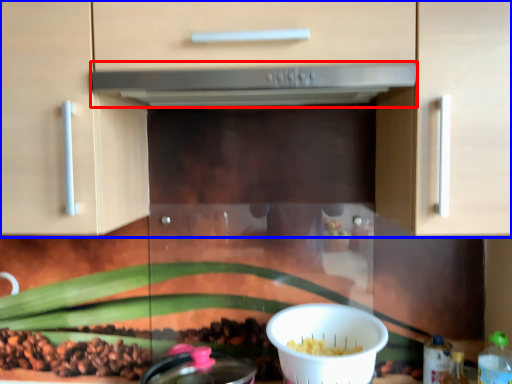
Question: Among these objects, which one is nearest to the camera, home appliance (highlighted by a red box) or cabinetry (highlighted by a blue box)?

Choices:
 (A) home appliance
 (B) cabinetry

Answer: (B)